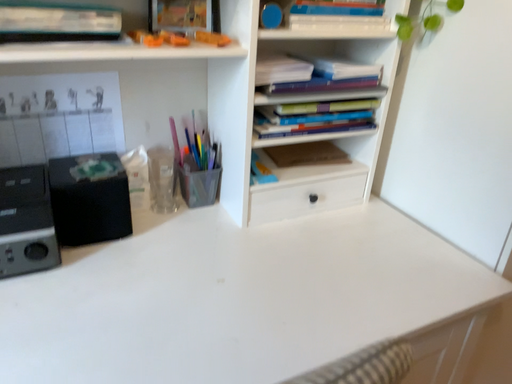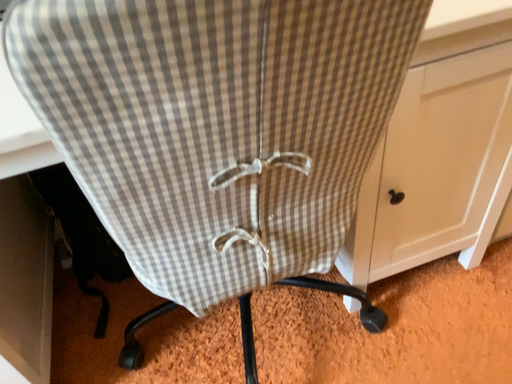
Question: How did the camera likely rotate when shooting the video?

Choices:
 (A) rotated downward
 (B) rotated upward

Answer: (A)